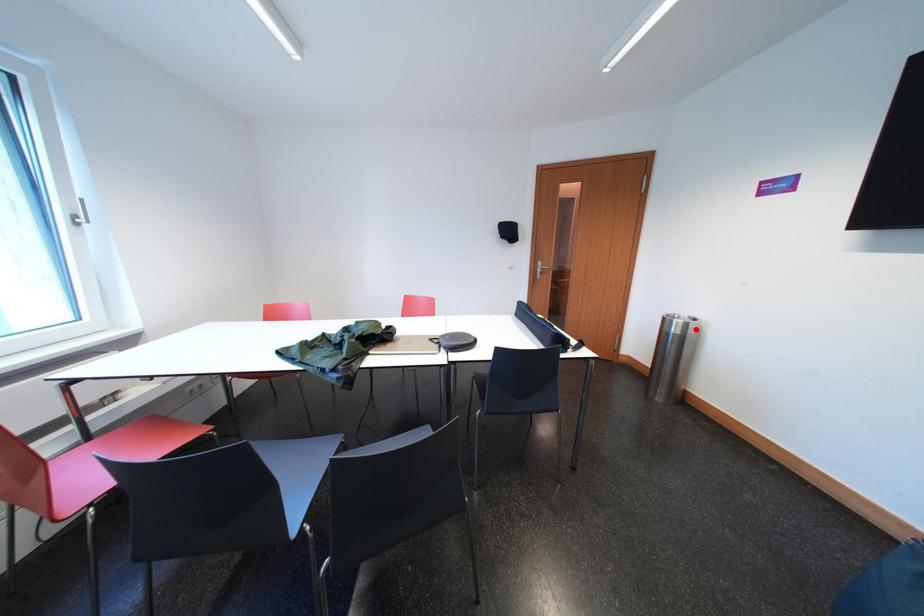
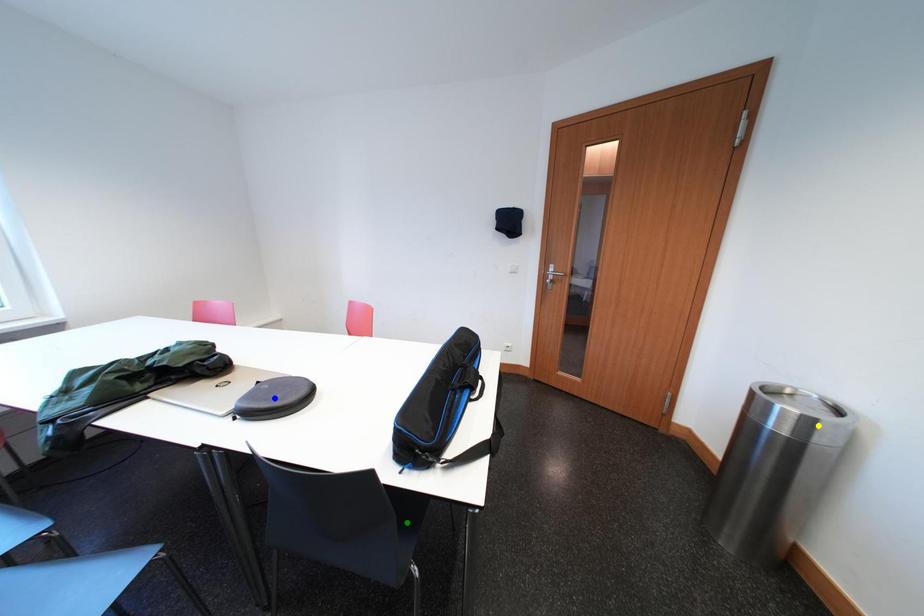
Question: I am providing you with two images of the same scene from different viewpoints. A red point is marked on the first image. You are given multiple points on the second image. Can you choose the point in image 2 that corresponds to the point in image 1?

Choices:
 (A) green point
 (B) yellow point
 (C) blue point

Answer: (B)